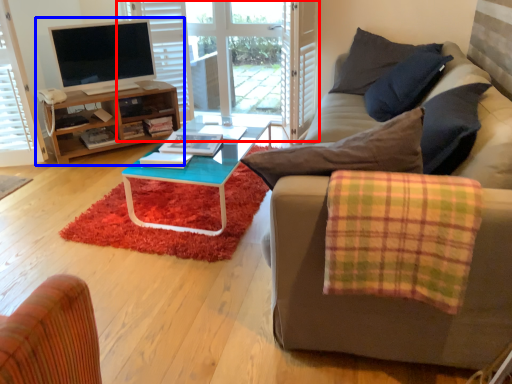
Question: Which object is further to the camera taking this photo, glass door (highlighted by a red box) or entertainment center (highlighted by a blue box)?

Choices:
 (A) glass door
 (B) entertainment center

Answer: (A)